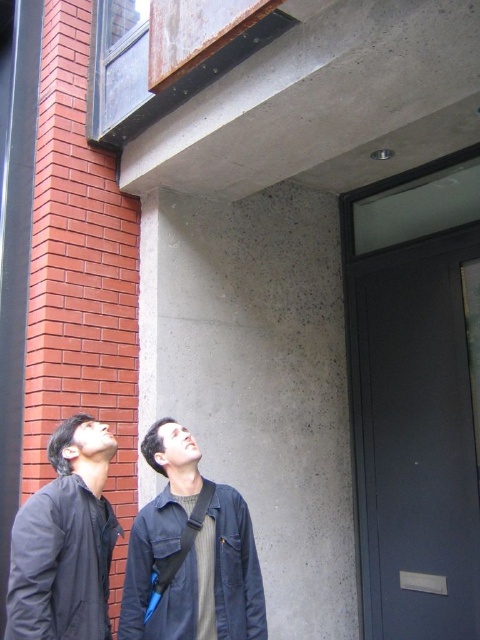
In the scene shown: You are one of the people in the image looking at the building. There are two points marked on the building. The first point is at coordinates point (108, 634) and the second point is at point (169, 532). Which point is closer to you?

Point (108, 634) is in front of point (169, 532), so the first point is closer to you.

Based on the photo, you are a fashion designer observing two jackets in the image. The jackets are the dark blue jacket at lower left and the dark blue cotton jacket at lower center. Which jacket is covering the other?

The dark blue jacket at lower left is positioned over the dark blue cotton jacket at lower center, so it is covering the other jacket.

You are a fashion designer observing two jackets in an outdoor setting. The jackets are the dark blue jacket at lower left and the dark blue cotton jacket at lower center. Which of these jackets appears larger in size?

The dark blue jacket at lower left appears larger than the dark blue cotton jacket at lower center.